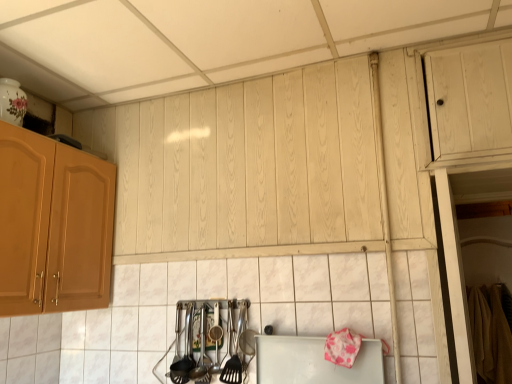
Find the location of a particular element. Image resolution: width=512 pixels, height=384 pixels. white matte cutting board at lower center is located at coordinates (314, 362).

The width and height of the screenshot is (512, 384). Identify the location of polished stainless steel utensils at lower center, acting as the second silverware starting from the left. (234, 358).

Looking at this image, considering the positions of objects polished metal utensils at lower center, which is the first silverware from left to right, and polished stainless steel utensils at lower center, the first silverware viewed from the right, in the image provided, who is behind, polished metal utensils at lower center, which is the first silverware from left to right, or polished stainless steel utensils at lower center, the first silverware viewed from the right,?

polished metal utensils at lower center, which is the first silverware from left to right, is more distant.

Does point (178, 381) appear closer or farther from the camera than point (238, 326)?

Point (178, 381).

Does polished metal utensils at lower center, which is the first silverware from left to right, turn towards polished stainless steel utensils at lower center, acting as the second silverware starting from the left?

No, polished metal utensils at lower center, which is the first silverware from left to right, is not oriented towards polished stainless steel utensils at lower center, acting as the second silverware starting from the left.

How different are the orientations of white glossy tile at center and polished metal utensils at lower center, the 2th silverware positioned from the right, in degrees?

white glossy tile at center and polished metal utensils at lower center, the 2th silverware positioned from the right, are facing 7.99 degrees away from each other.

Is white glossy tile at center oriented towards polished metal utensils at lower center, which is the first silverware from left to right?

Yes, white glossy tile at center is oriented towards polished metal utensils at lower center, which is the first silverware from left to right.

Which is closer to the camera, (438, 287) or (176, 369)?

The point (438, 287) is closer to the camera.

Between white glossy tile at center and polished metal utensils at lower center, which is the first silverware from left to right, which one appears on the right side from the viewer's perspective?

From the viewer's perspective, white glossy tile at center appears more on the right side.

Is polished stainless steel utensils at lower center, the first silverware viewed from the right, not inside white matte cutting board at lower center?

polished stainless steel utensils at lower center, the first silverware viewed from the right, is positioned outside white matte cutting board at lower center.

From a real-world perspective, is polished stainless steel utensils at lower center, acting as the second silverware starting from the left, positioned over white matte cutting board at lower center based on gravity?

Yes.

Does polished stainless steel utensils at lower center, the first silverware viewed from the right, have a greater height compared to white matte cutting board at lower center?

Indeed, polished stainless steel utensils at lower center, the first silverware viewed from the right, has a greater height compared to white matte cutting board at lower center.

From the image's perspective, which one is positioned higher, white glossy tile at center or polished stainless steel utensils at lower center, the first silverware viewed from the right?

white glossy tile at center, from the image's perspective.

Which is more to the left, white glossy tile at center or polished stainless steel utensils at lower center, the first silverware viewed from the right?

From the viewer's perspective, white glossy tile at center appears more on the left side.

Is white glossy tile at center directly adjacent to polished stainless steel utensils at lower center, the first silverware viewed from the right?

white glossy tile at center and polished stainless steel utensils at lower center, the first silverware viewed from the right, are not in contact.

Does point (121, 355) lie behind point (231, 366)?

Yes, point (121, 355) is behind point (231, 366).

This screenshot has height=384, width=512. What are the coordinates of `appliance below the polished metal utensils at lower center, which is the first silverware from left to right (from a real-world perspective)` in the screenshot? It's located at (314, 362).

Consider the image. From the image's perspective, is white matte cutting board at lower center located beneath polished metal utensils at lower center, which is the first silverware from left to right?

Yes, from the image's perspective, white matte cutting board at lower center is below polished metal utensils at lower center, which is the first silverware from left to right.

Can you tell me how much white matte cutting board at lower center and polished metal utensils at lower center, the 2th silverware positioned from the right, differ in facing direction?

8.73 degrees separate the facing orientations of white matte cutting board at lower center and polished metal utensils at lower center, the 2th silverware positioned from the right.

From a real-world perspective, which is physically below, polished metal utensils at lower center, which is the first silverware from left to right, or white matte cutting board at lower center?

white matte cutting board at lower center, from a real-world perspective.

Looking at their sizes, would you say polished metal utensils at lower center, which is the first silverware from left to right, is wider or thinner than white matte cutting board at lower center?

Clearly, polished metal utensils at lower center, which is the first silverware from left to right, has more width compared to white matte cutting board at lower center.

From the image's perspective, would you say polished metal utensils at lower center, the 2th silverware positioned from the right, is positioned over white matte cutting board at lower center?

Correct, polished metal utensils at lower center, the 2th silverware positioned from the right, appears higher than white matte cutting board at lower center in the image.

Is polished metal utensils at lower center, which is the first silverware from left to right, facing away from white matte cutting board at lower center?

That's not correct — polished metal utensils at lower center, which is the first silverware from left to right, is not looking away from white matte cutting board at lower center.

From the image's perspective, is white glossy tile at center located above or below white matte cutting board at lower center?

white glossy tile at center is above white matte cutting board at lower center.

Does point (411, 300) lie behind point (294, 373)?

No, it is in front of (294, 373).

Is white glossy tile at center not within white matte cutting board at lower center?

Yes, white glossy tile at center is located beyond the bounds of white matte cutting board at lower center.

Is white glossy tile at center wider or thinner than white matte cutting board at lower center?

white glossy tile at center is wider than white matte cutting board at lower center.

Find the location of `silverware beneath the polished metal utensils at lower center, the 2th silverware positioned from the right (from a real-world perspective)`. silverware beneath the polished metal utensils at lower center, the 2th silverware positioned from the right (from a real-world perspective) is located at coordinates (234, 358).

From the white glossy tile at center, count 2nd silverwares backward and point to it. Please provide its 2D coordinates.

[(184, 352)]

Which object lies further to the anchor point white glossy tile at center, white matte cutting board at lower center or polished stainless steel utensils at lower center, acting as the second silverware starting from the left?

Based on the image, polished stainless steel utensils at lower center, acting as the second silverware starting from the left, appears to be further to white glossy tile at center.

Based on the photo, considering their positions, is polished metal utensils at lower center, which is the first silverware from left to right, positioned further to polished stainless steel utensils at lower center, acting as the second silverware starting from the left, than white glossy tile at center?

white glossy tile at center is further to polished stainless steel utensils at lower center, acting as the second silverware starting from the left.

When comparing their distances from white glossy tile at center, does white matte cutting board at lower center or polished metal utensils at lower center, which is the first silverware from left to right, seem further?

Based on the image, polished metal utensils at lower center, which is the first silverware from left to right, appears to be further to white glossy tile at center.

Based on their spatial positions, is white glossy tile at center or polished metal utensils at lower center, the 2th silverware positioned from the right, closer to polished stainless steel utensils at lower center, the first silverware viewed from the right?

Based on the image, polished metal utensils at lower center, the 2th silverware positioned from the right, appears to be nearer to polished stainless steel utensils at lower center, the first silverware viewed from the right.

When comparing their distances from white matte cutting board at lower center, does polished stainless steel utensils at lower center, acting as the second silverware starting from the left, or polished metal utensils at lower center, the 2th silverware positioned from the right, seem further?

polished metal utensils at lower center, the 2th silverware positioned from the right, is positioned further to the anchor white matte cutting board at lower center.

In the scene shown: Which object lies further to the anchor point white glossy tile at center, polished metal utensils at lower center, the 2th silverware positioned from the right, or polished stainless steel utensils at lower center, acting as the second silverware starting from the left?

The object further to white glossy tile at center is polished stainless steel utensils at lower center, acting as the second silverware starting from the left.

Considering their positions, is polished metal utensils at lower center, the 2th silverware positioned from the right, positioned closer to white matte cutting board at lower center than white glossy tile at center?

Based on the image, white glossy tile at center appears to be nearer to white matte cutting board at lower center.

From the image, which object appears to be farther from white glossy tile at center, polished stainless steel utensils at lower center, the first silverware viewed from the right, or white matte cutting board at lower center?

The object further to white glossy tile at center is polished stainless steel utensils at lower center, the first silverware viewed from the right.

At what (x,y) coordinates should I click in order to perform the action: click on silverware between polished metal utensils at lower center, the 2th silverware positioned from the right, and white matte cutting board at lower center. Please return your answer as a coordinate pair (x, y). Looking at the image, I should click on (234, 358).

This screenshot has height=384, width=512. What are the coordinates of `silverware between white glossy tile at center and polished metal utensils at lower center, which is the first silverware from left to right, in the front-back direction` in the screenshot? It's located at (234, 358).

Where is `tile between polished metal utensils at lower center, the 2th silverware positioned from the right, and white matte cutting board at lower center`? The height and width of the screenshot is (384, 512). tile between polished metal utensils at lower center, the 2th silverware positioned from the right, and white matte cutting board at lower center is located at coordinates (227, 297).

Where is `silverware between white glossy tile at center and white matte cutting board at lower center`? The width and height of the screenshot is (512, 384). silverware between white glossy tile at center and white matte cutting board at lower center is located at coordinates (234, 358).